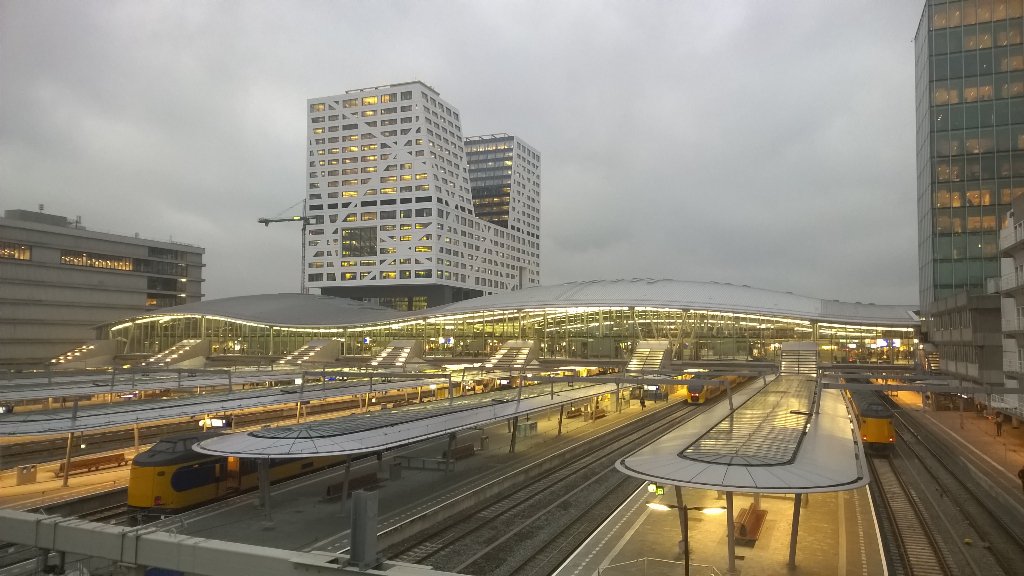
The width and height of the screenshot is (1024, 576). Find the location of `bench`. bench is located at coordinates (751, 529), (355, 477), (455, 450), (581, 414), (97, 458).